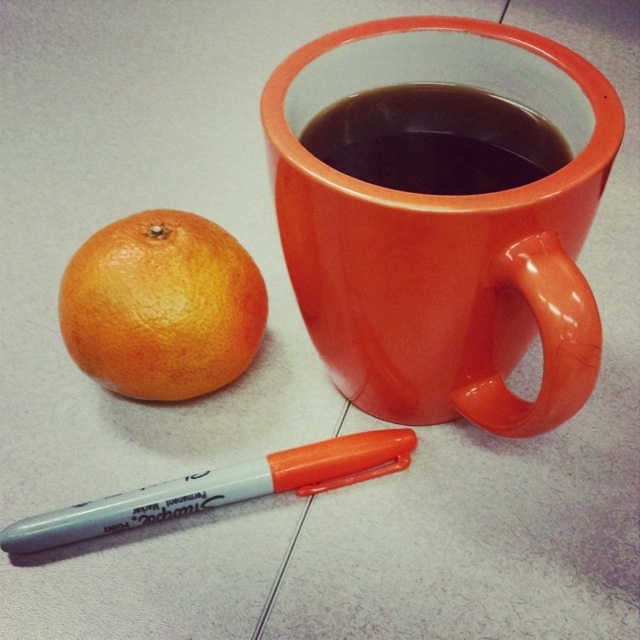
You are trying to reach for the glossy ceramic mug at upper center and the gray plastic marker at lower left. Which object is closer to your hand if you are standing directly in front of the image?

The glossy ceramic mug at upper center is closer to the viewer than the gray plastic marker at lower left, so you would reach the glossy ceramic mug at upper center first.

Looking at this image, you are organizing a small table and need to place both the glossy ceramic mug at upper center and the gray plastic marker at lower left. If you want to arrange them side by side without overlapping, which object should you place first to ensure there is enough space?

The glossy ceramic mug at upper center has a lesser width compared to the gray plastic marker at lower left. Therefore, you should place the gray plastic marker at lower left first to accommodate its larger width, then position the glossy ceramic mug at upper center next to it.

You are holding a ruler and want to measure the distance from your eyes to the glossy ceramic mug at upper center. According to the scene description, what is the approximate distance in inches?

The glossy ceramic mug at upper center is approximately 30.98 inches away from the viewer.